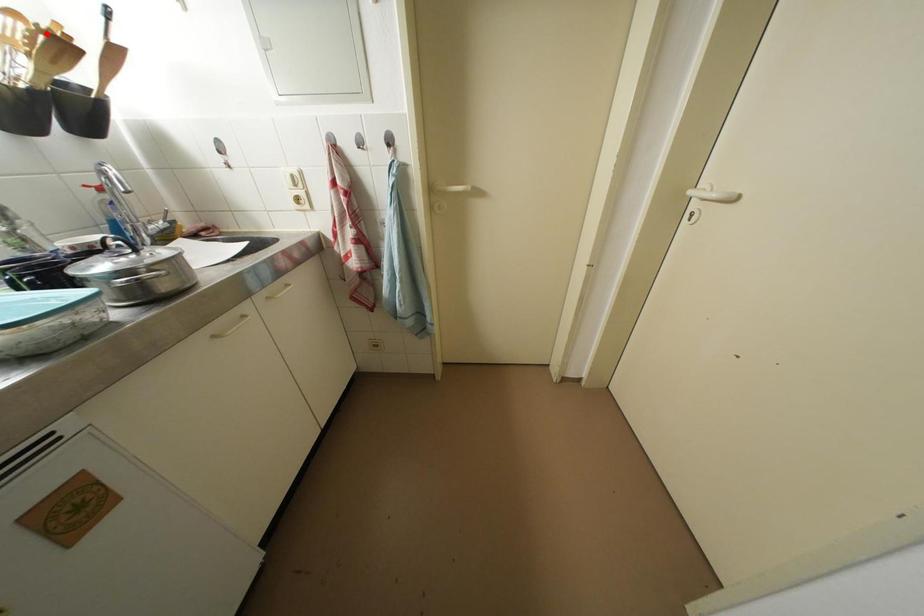
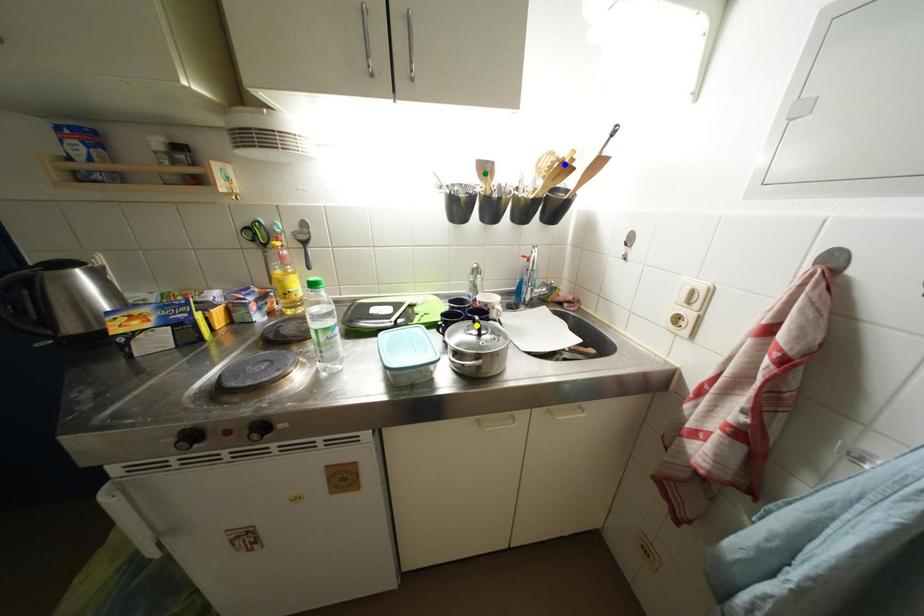
Question: I am providing you with two images of the same scene from different viewpoints. A red point is marked on the first image. You are given multiple points on the second image. Can you choose the point in image 2 that corresponds to the point in image 1?

Choices:
 (A) green point
 (B) yellow point
 (C) blue point

Answer: (C)